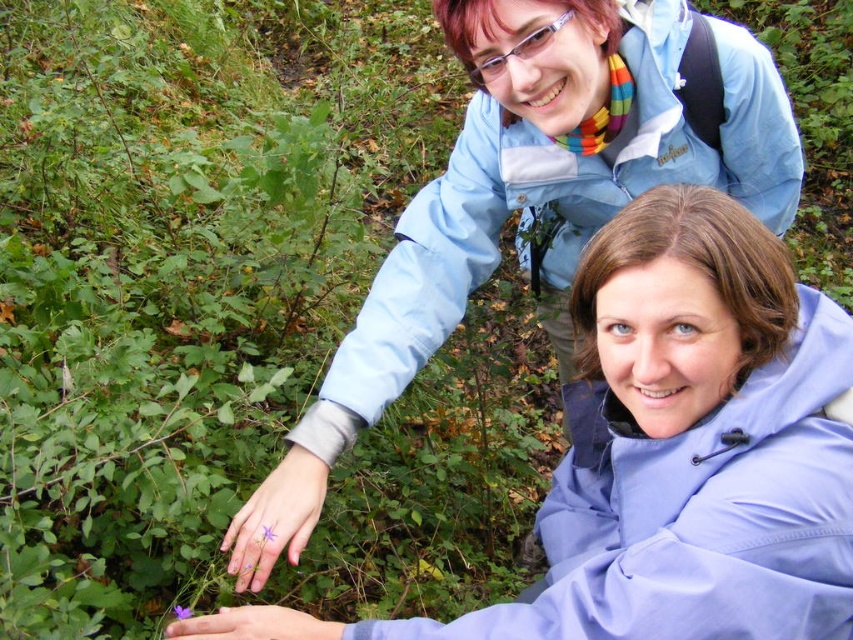
Question: Does matte blue jacket at upper center have a greater width compared to light blue fabric jacket at upper center?

Choices:
 (A) yes
 (B) no

Answer: (B)

Question: Among these objects, which one is farthest from the camera?

Choices:
 (A) matte blue jacket at upper center
 (B) light blue fabric jacket at upper center

Answer: (B)

Question: Can you confirm if matte blue jacket at upper center is positioned to the left of light blue fabric jacket at upper center?

Choices:
 (A) yes
 (B) no

Answer: (B)

Question: Observing the image, what is the correct spatial positioning of matte blue jacket at upper center in reference to light blue fabric jacket at upper center?

Choices:
 (A) left
 (B) right

Answer: (B)